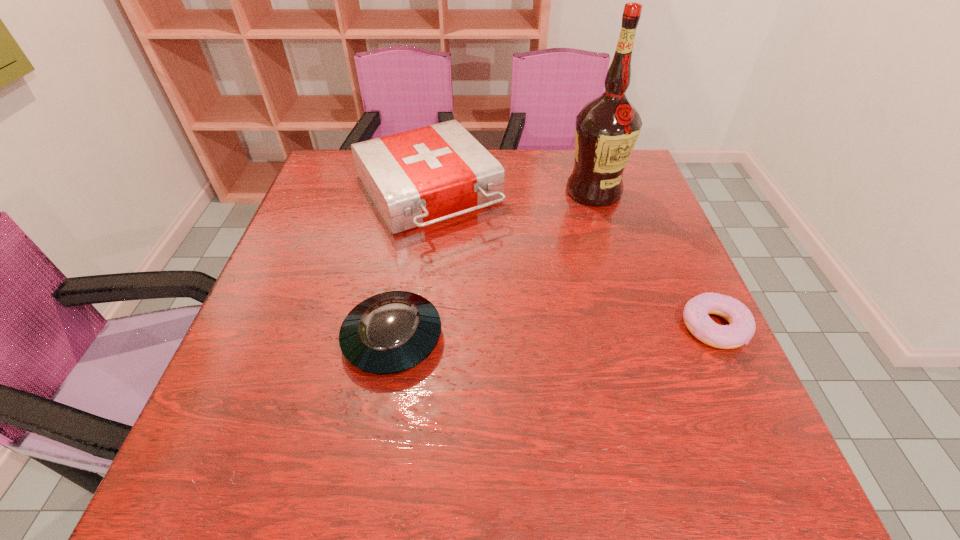
Identify the location of blank space that satisfies the following two spatial constraints: 1. on the front side of the first-aid kit; 2. on the left side of the rightmost object. (408, 327).

Find the location of a particular element. vacant region that satisfies the following two spatial constraints: 1. on the front side of the first-aid kit; 2. on the left side of the doughnut is located at coordinates (408, 327).

This screenshot has height=540, width=960. I want to click on free spot that satisfies the following two spatial constraints: 1. on the back side of the rightmost object; 2. on the left side of the second shortest object, so 395,327.